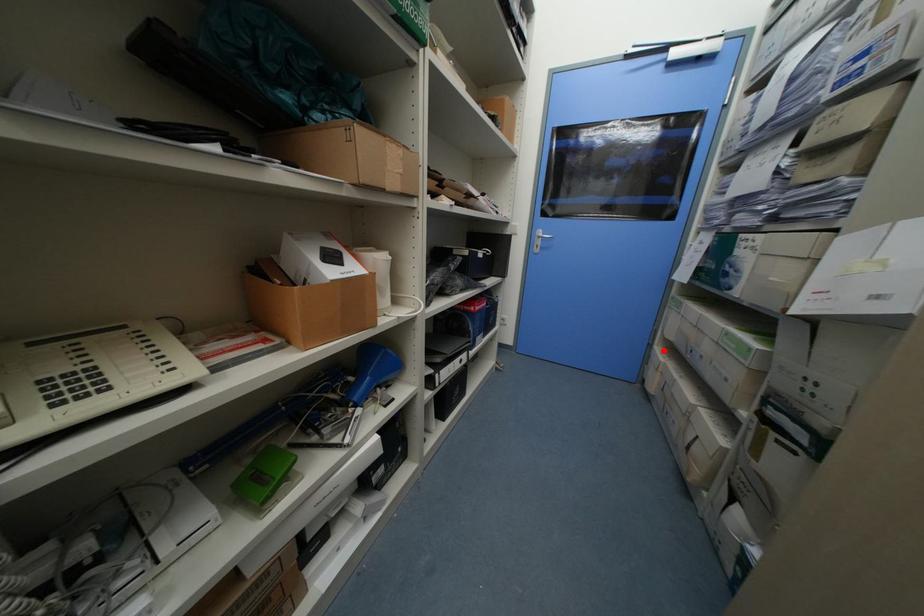
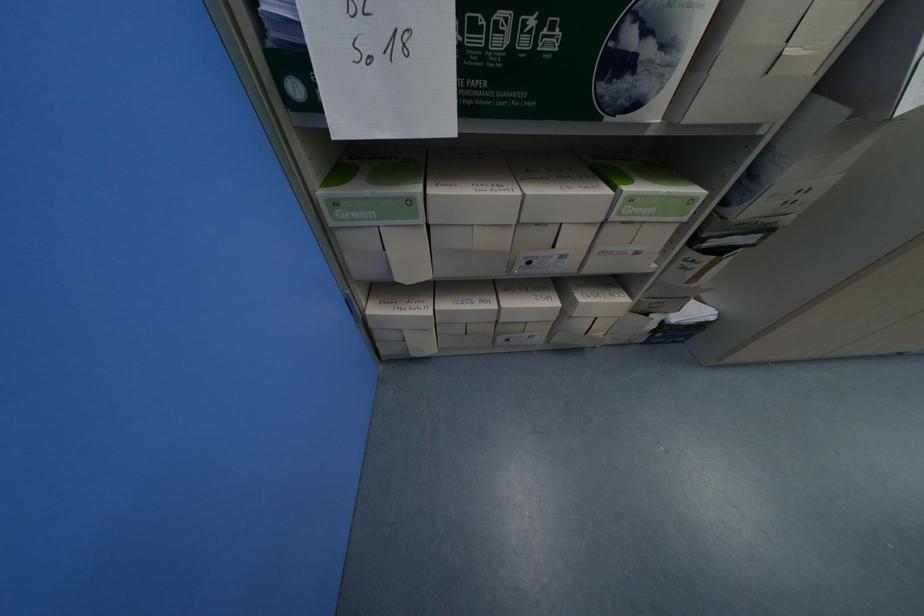
The point at the highlighted location is marked in the first image. Where is the corresponding point in the second image?

(381, 312)